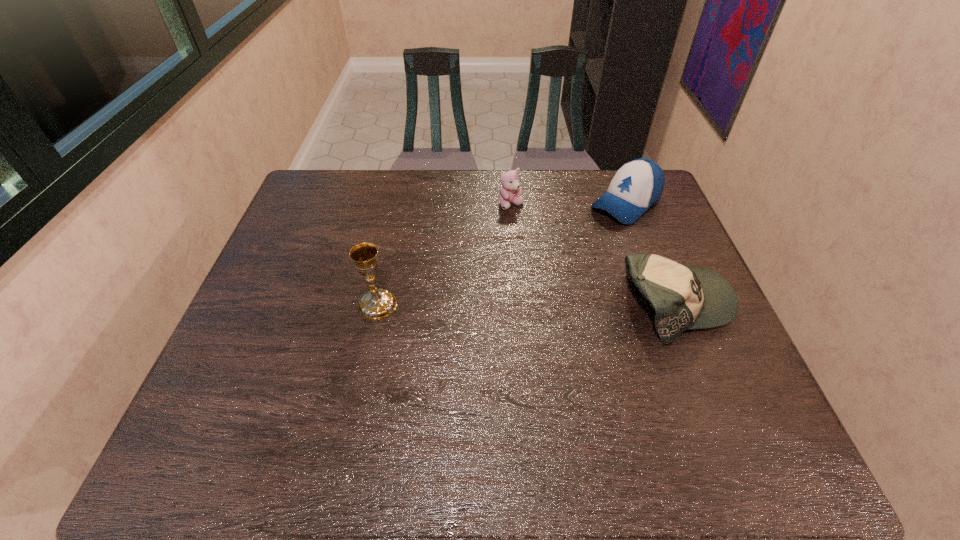
Where is `the tallest object`? The height and width of the screenshot is (540, 960). the tallest object is located at coordinates (377, 304).

Where is `the leftmost object`? Image resolution: width=960 pixels, height=540 pixels. the leftmost object is located at coordinates (377, 304).

Locate an element on the screen. The image size is (960, 540). the nearer baseball cap is located at coordinates (685, 297).

Identify the location of the farther baseball cap. The height and width of the screenshot is (540, 960). (637, 185).

This screenshot has height=540, width=960. I want to click on the second object from left to right, so click(509, 191).

In order to click on vacant space located 0.240m on the right of the leftmost object in this screenshot , I will do `click(492, 305)`.

At what (x,y) coordinates should I click in order to perform the action: click on vacant space located on the front-facing side of the farther baseball cap. Please return your answer as a coordinate pair (x, y). This screenshot has width=960, height=540. Looking at the image, I should click on (585, 235).

What are the coordinates of `vacant space located on the front-facing side of the farther baseball cap` in the screenshot? It's located at (588, 234).

The width and height of the screenshot is (960, 540). Identify the location of free spot located on the front-facing side of the farther baseball cap. (570, 247).

Image resolution: width=960 pixels, height=540 pixels. I want to click on vacant space located at the face of the teddy bear, so click(522, 228).